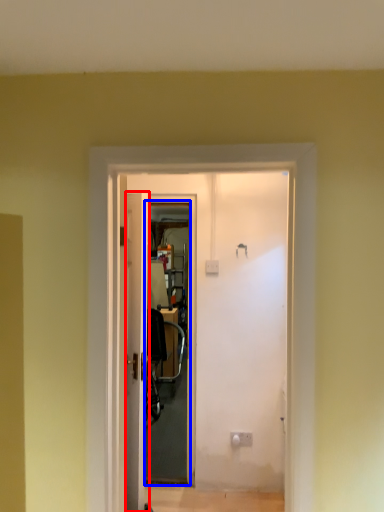
Question: Which object appears farthest to the camera in this image, door (highlighted by a red box) or screen door (highlighted by a blue box)?

Choices:
 (A) door
 (B) screen door

Answer: (B)